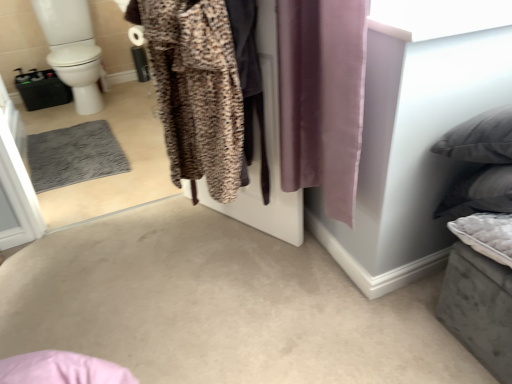
Describe the element at coordinates (197, 90) in the screenshot. The image size is (512, 384). I see `brown textured robe at center` at that location.

What do you see at coordinates (268, 157) in the screenshot? Image resolution: width=512 pixels, height=384 pixels. I see `leopard print fabric at center` at bounding box center [268, 157].

Image resolution: width=512 pixels, height=384 pixels. What do you see at coordinates (73, 50) in the screenshot? I see `white glossy toilet bowl at left` at bounding box center [73, 50].

Find the location of `brown textured robe at center`. brown textured robe at center is located at coordinates (197, 90).

Which object is thinner, brown textured robe at center or white glossy toilet bowl at left?

brown textured robe at center is thinner.

Would you say brown textured robe at center is inside or outside white glossy toilet bowl at left?

The correct answer is: outside.

Looking at this image, how different are the orientations of brown textured robe at center and white glossy toilet bowl at left in degrees?

brown textured robe at center and white glossy toilet bowl at left are facing 62 degrees away from each other.

Is brown textured robe at center further to camera compared to white glossy toilet bowl at left?

No, it is not.

Can you confirm if white glossy toilet bowl at left is positioned to the right of brown textured robe at center?

Incorrect, white glossy toilet bowl at left is not on the right side of brown textured robe at center.

Which of these two, white glossy toilet bowl at left or brown textured robe at center, is wider?

With larger width is white glossy toilet bowl at left.

Is brown textured robe at center located within white glossy toilet bowl at left?

No, brown textured robe at center is not inside white glossy toilet bowl at left.

In the image, is white glossy toilet bowl at left positioned in front of or behind brown textured robe at center?

Clearly, white glossy toilet bowl at left is behind brown textured robe at center.

Considering the points (294, 243) and (228, 186), which point is in front, point (294, 243) or point (228, 186)?

The point (228, 186) is more forward.

Can you confirm if leopard print fabric at center is shorter than brown textured robe at center?

Incorrect, the height of leopard print fabric at center does not fall short of that of brown textured robe at center.

Is leopard print fabric at center spatially inside brown textured robe at center, or outside of it?

leopard print fabric at center is located inside brown textured robe at center.

Is leopard print fabric at center far from white glossy toilet bowl at left?

Yes, leopard print fabric at center and white glossy toilet bowl at left are located far from each other.

From a real-world perspective, which is physically above, leopard print fabric at center or white glossy toilet bowl at left?

In real-world perspective, leopard print fabric at center is above.

From the image's perspective, is leopard print fabric at center below white glossy toilet bowl at left?

Yes, from the image's perspective, leopard print fabric at center is below white glossy toilet bowl at left.

Is the surface of brown textured robe at center in direct contact with purple silky curtain at center?

brown textured robe at center and purple silky curtain at center are not in contact.

Considering the relative sizes of brown textured robe at center and purple silky curtain at center in the image provided, is brown textured robe at center taller than purple silky curtain at center?

Yes.

Is brown textured robe at center at the left side of purple silky curtain at center?

Correct, you'll find brown textured robe at center to the left of purple silky curtain at center.

Between point (168, 141) and point (317, 52), which one is positioned behind?

The point (168, 141) is more distant.

Are purple silky curtain at center and brown textured robe at center located far from each other?

purple silky curtain at center is actually quite close to brown textured robe at center.

At what (x,y) coordinates should I click in order to perform the action: click on curtain lying below the brown textured robe at center (from the image's perspective). Please return your answer as a coordinate pair (x, y). The width and height of the screenshot is (512, 384). Looking at the image, I should click on (322, 98).

How far apart are purple silky curtain at center and brown textured robe at center?

A distance of 11.14 inches exists between purple silky curtain at center and brown textured robe at center.

From the image's perspective, does white glossy toilet bowl at left appear lower than purple silky curtain at center?

Actually, white glossy toilet bowl at left appears above purple silky curtain at center in the image.

Is point (60, 15) positioned after point (308, 29)?

That is True.

Based on the photo, is white glossy toilet bowl at left oriented away from purple silky curtain at center?

No, white glossy toilet bowl at left is not facing the opposite direction of purple silky curtain at center.

Between white glossy toilet bowl at left and purple silky curtain at center, which one has smaller size?

purple silky curtain at center.

Where is `toilet bowl that appears above the brown textured robe at center (from the image's perspective)`? This screenshot has width=512, height=384. toilet bowl that appears above the brown textured robe at center (from the image's perspective) is located at coordinates 73,50.

Identify the location of toilet bowl that is under the brown textured robe at center (from a real-world perspective). Image resolution: width=512 pixels, height=384 pixels. (73, 50).

From the image, which object appears to be farther from brown textured robe at center, leopard print fabric at center or purple silky curtain at center?

purple silky curtain at center lies further to brown textured robe at center than the other object.

Estimate the real-world distances between objects in this image. Which object is closer to leopard print fabric at center, white glossy toilet bowl at left or brown textured robe at center?

The object closer to leopard print fabric at center is brown textured robe at center.

Considering their positions, is purple silky curtain at center positioned further to leopard print fabric at center than brown textured robe at center?

brown textured robe at center.

Based on their spatial positions, is purple silky curtain at center or white glossy toilet bowl at left further from brown textured robe at center?

white glossy toilet bowl at left is further to brown textured robe at center.

Based on their spatial positions, is purple silky curtain at center or brown textured robe at center closer to white glossy toilet bowl at left?

brown textured robe at center.

From the image, which object appears to be nearer to purple silky curtain at center, leopard print fabric at center or brown textured robe at center?

leopard print fabric at center is closer to purple silky curtain at center.

When comparing their distances from white glossy toilet bowl at left, does brown textured robe at center or leopard print fabric at center seem closer?

leopard print fabric at center lies closer to white glossy toilet bowl at left than the other object.

Estimate the real-world distances between objects in this image. Which object is closer to brown textured robe at center, white glossy toilet bowl at left or purple silky curtain at center?

The object closer to brown textured robe at center is purple silky curtain at center.

You are a GUI agent. You are given a task and a screenshot of the screen. Output one action in this format:
    pyautogui.click(x=<x>, y=<y>)
    Task: Click on the screen door between brown textured robe at center and white glossy toilet bowl at left along the z-axis
    This screenshot has width=512, height=384.
    Given the screenshot: What is the action you would take?
    pyautogui.click(x=268, y=157)

In order to click on clothing between purple silky curtain at center and white glossy toilet bowl at left in the front-back direction in this screenshot , I will do `click(197, 90)`.

This screenshot has height=384, width=512. Identify the location of screen door between purple silky curtain at center and white glossy toilet bowl at left from front to back. (268, 157).

Image resolution: width=512 pixels, height=384 pixels. Find the location of `screen door situated between brown textured robe at center and purple silky curtain at center from left to right`. screen door situated between brown textured robe at center and purple silky curtain at center from left to right is located at coordinates (268, 157).